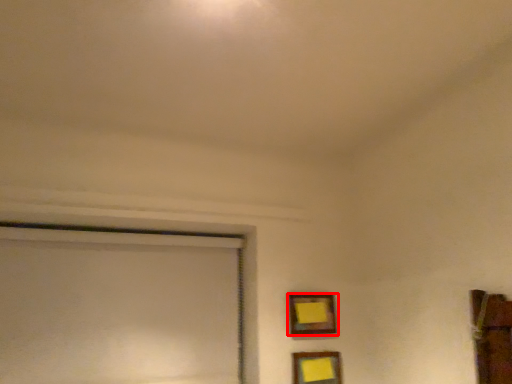
Question: From the image's perspective, where is picture frame (annotated by the red box) located in relation to picture frame in the image?

Choices:
 (A) below
 (B) above

Answer: (B)